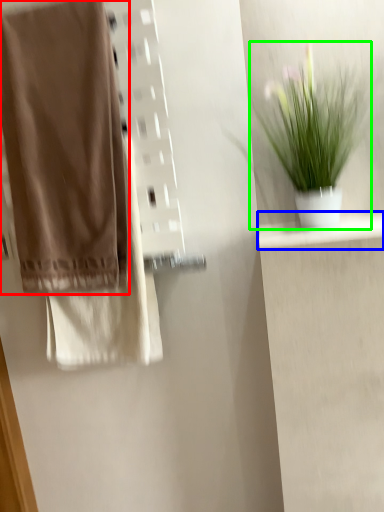
Question: Which object is positioned closest to towel (highlighted by a red box)? Select from shelf (highlighted by a blue box) and houseplant (highlighted by a green box).

Choices:
 (A) shelf
 (B) houseplant

Answer: (B)